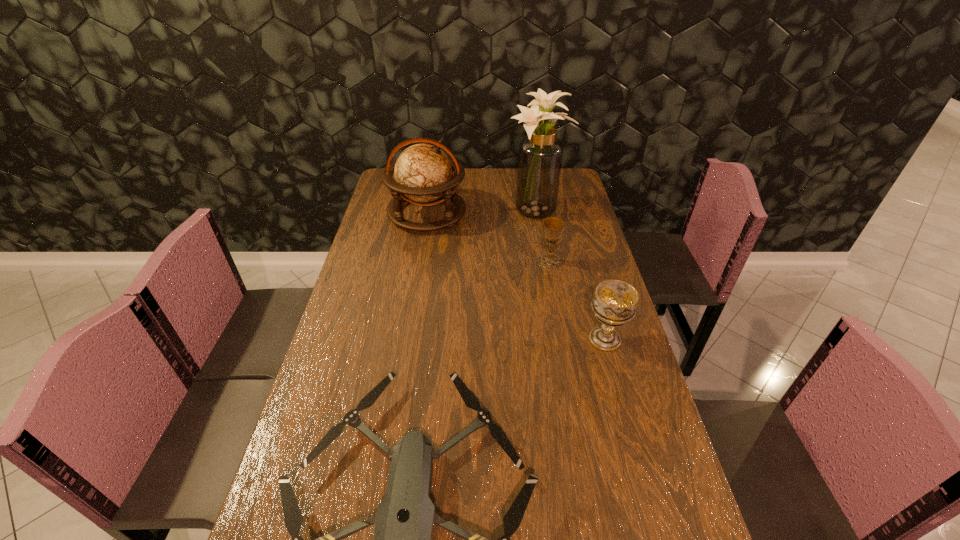
Image resolution: width=960 pixels, height=540 pixels. I want to click on free space that is in between the farther chalice and the globe, so click(x=489, y=238).

Identify the location of free point between the farther chalice and the tallest object. Image resolution: width=960 pixels, height=540 pixels. (543, 237).

The width and height of the screenshot is (960, 540). In order to click on vacant area between the globe and the tallest object in this screenshot , I will do `click(482, 212)`.

The image size is (960, 540). I want to click on the third closest object to the drone, so click(x=423, y=173).

I want to click on object that is the fourth closest to the shortest object, so click(x=540, y=156).

Image resolution: width=960 pixels, height=540 pixels. Find the location of `free space that satisfies the following two spatial constraints: 1. on the front side of the fourth shortest object; 2. on the right side of the nearer chalice`. free space that satisfies the following two spatial constraints: 1. on the front side of the fourth shortest object; 2. on the right side of the nearer chalice is located at coordinates click(406, 339).